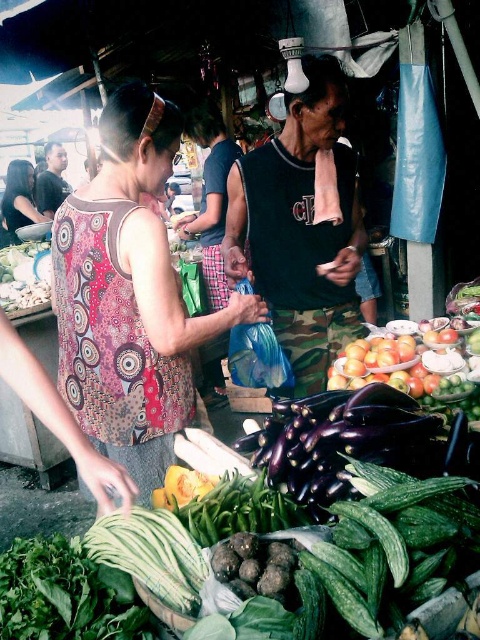
What is the 2D coordinate of the printed fabric tank top at center?

The printed fabric tank top at center is located at the 2D coordinate point of [130,296].

You are standing in the market and want to take a photo of both the vegetables on the table and the two people in the middle ground. Which of the two points, point (225,269) or point (34,188), should you focus on to ensure both the foreground vegetables and the middle ground people are in focus?

You should focus on point (34,188) because it is farther from the camera than point (225,269), allowing for a greater depth of field to keep both the foreground vegetables and the middle ground people in focus.